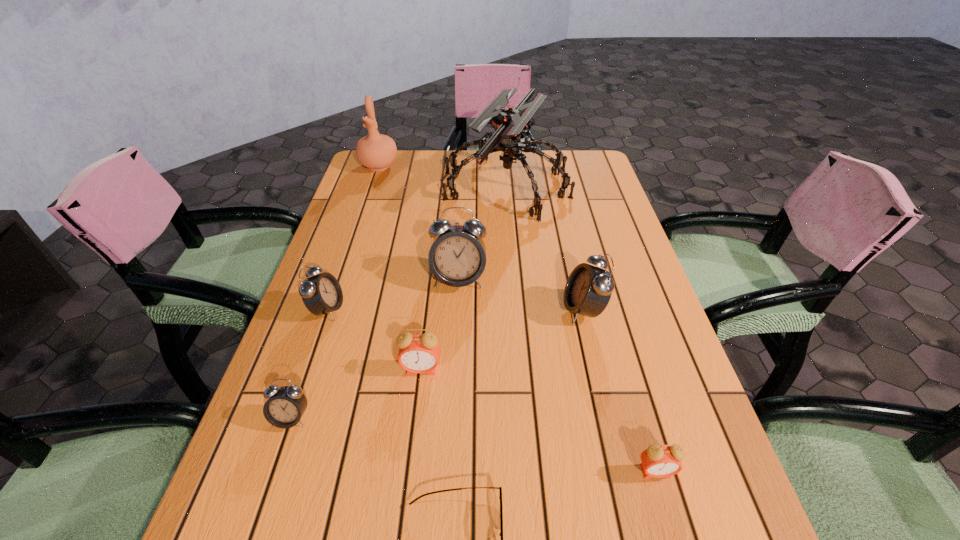
In order to click on free location located 0.130m on the face of the bigger pink alarm clock in this screenshot , I will do `click(413, 439)`.

Locate an element on the screen. The height and width of the screenshot is (540, 960). free space located on the face of the nearest white alarm clock is located at coordinates (258, 516).

You are a GUI agent. You are given a task and a screenshot of the screen. Output one action in this format:
    pyautogui.click(x=<x>, y=<y>)
    Task: Click on the drone that is at the far edge
    This screenshot has width=960, height=540.
    Given the screenshot: What is the action you would take?
    coord(509,123)

The image size is (960, 540). Identify the location of pottery located in the far edge section of the desktop. (377, 152).

Image resolution: width=960 pixels, height=540 pixels. What are the coordinates of `pottery present at the left edge` in the screenshot? It's located at (377, 152).

Find the location of a particular element. drone situated at the right edge is located at coordinates (509, 123).

In order to click on object that is at the far left corner in this screenshot , I will do `click(377, 152)`.

The image size is (960, 540). In order to click on object present at the far right corner in this screenshot , I will do `click(509, 123)`.

Where is `free point at the far edge`? This screenshot has height=540, width=960. free point at the far edge is located at coordinates (535, 175).

In the image, there is a desktop. Where is `vacant space at the left edge`? vacant space at the left edge is located at coordinates (323, 256).